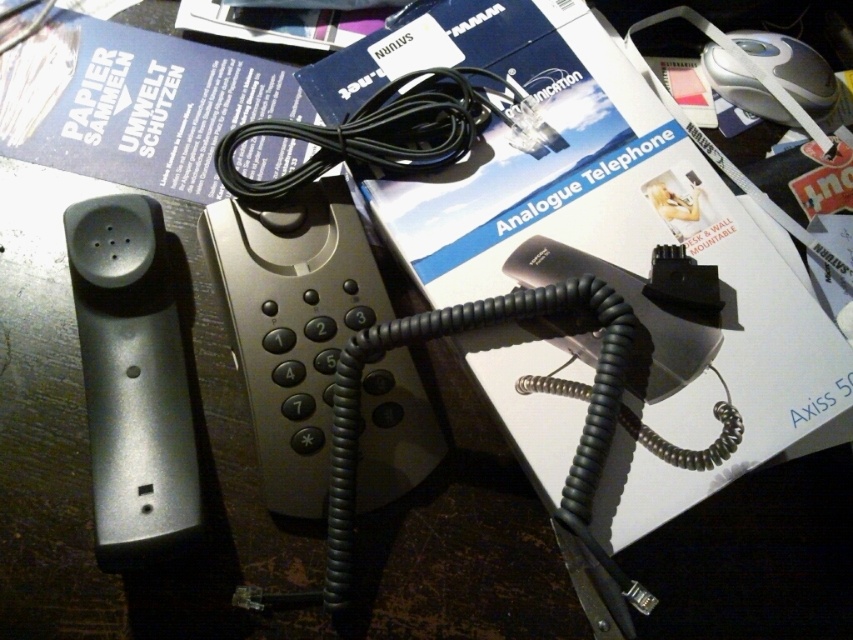
You are organizing the desk and need to place a new item on the blue paper at upper left. Where exactly should you place it?

The blue paper at upper left is located at point (134, 104), so you should place the new item at those coordinates to ensure it stays on the blue paper at upper left.

You are organizing items on a desk and see the blue paper at upper left and the matte gray handset at left. Which item is placed on top of the other?

The blue paper at upper left is positioned over the matte gray handset at left, so the blue paper is on top.